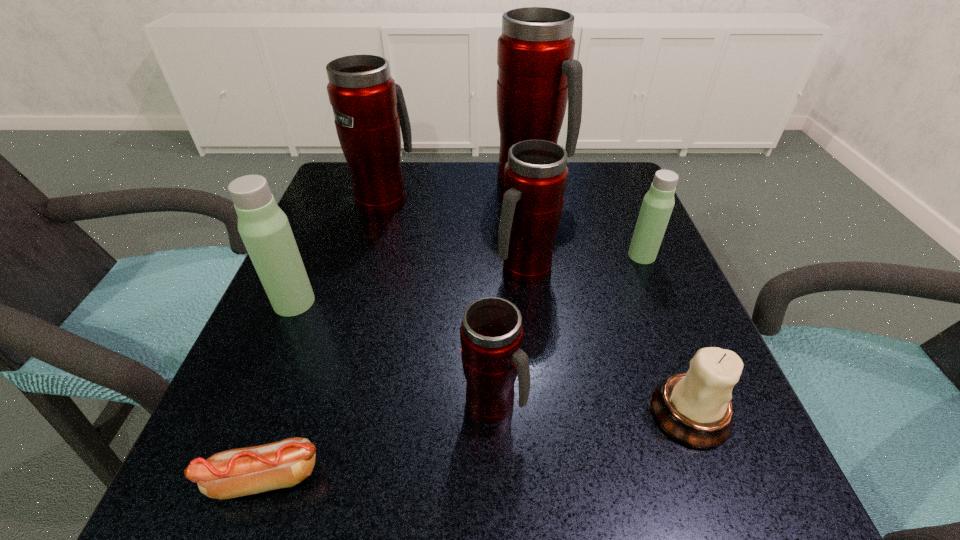
You are a GUI agent. You are given a task and a screenshot of the screen. Output one action in this format:
    pyautogui.click(x=<x>, y=<y>)
    Task: Click on the thermos bottle that is the second closest to the sausage
    The width and height of the screenshot is (960, 540).
    Given the screenshot: What is the action you would take?
    pyautogui.click(x=264, y=228)

Locate which red thermos bottle ranks third in proximity to the sausage. Please provide its 2D coordinates. Your answer should be formatted as a tuple, i.e. [(x, y)], where the tuple contains the x and y coordinates of a point satisfying the conditions above.

[(369, 108)]

Locate which red thermos bottle is the second closest to the nearest thermos bottle. Please provide its 2D coordinates. Your answer should be formatted as a tuple, i.e. [(x, y)], where the tuple contains the x and y coordinates of a point satisfying the conditions above.

[(369, 108)]

This screenshot has width=960, height=540. Identify the location of free space that satisfies the following two spatial constraints: 1. on the front side of the leftmost thermos bottle; 2. on the right side of the candle holder. (247, 413).

Where is `free space that satisfies the following two spatial constraints: 1. on the side with the handle of the biggest red thermos bottle; 2. on the side with the handle of the third biggest red thermos bottle`? free space that satisfies the following two spatial constraints: 1. on the side with the handle of the biggest red thermos bottle; 2. on the side with the handle of the third biggest red thermos bottle is located at coordinates (544, 269).

The height and width of the screenshot is (540, 960). Find the location of `vacant space that satisfies the following two spatial constraints: 1. on the side with the handle of the tallest thermos bottle; 2. on the back side of the rightmost thermos bottle`. vacant space that satisfies the following two spatial constraints: 1. on the side with the handle of the tallest thermos bottle; 2. on the back side of the rightmost thermos bottle is located at coordinates (541, 255).

The image size is (960, 540). In order to click on vacant point that satisfies the following two spatial constraints: 1. on the front side of the farther light thermos bottle; 2. on the side with the handle of the nearest thermos bottle in this screenshot , I will do `click(703, 403)`.